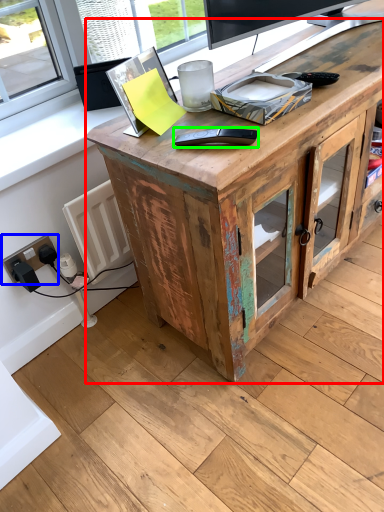
Question: Considering the real-world distances, which object is farthest from desk (highlighted by a red box)? electric outlet (highlighted by a blue box) or equipment (highlighted by a green box)?

Choices:
 (A) electric outlet
 (B) equipment

Answer: (A)